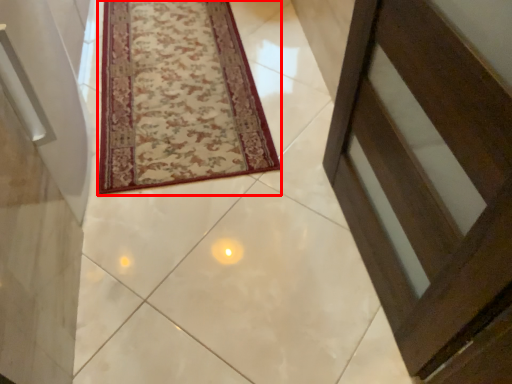
Question: Where is mat (annotated by the red box) located in relation to path in the image?

Choices:
 (A) right
 (B) left

Answer: (B)